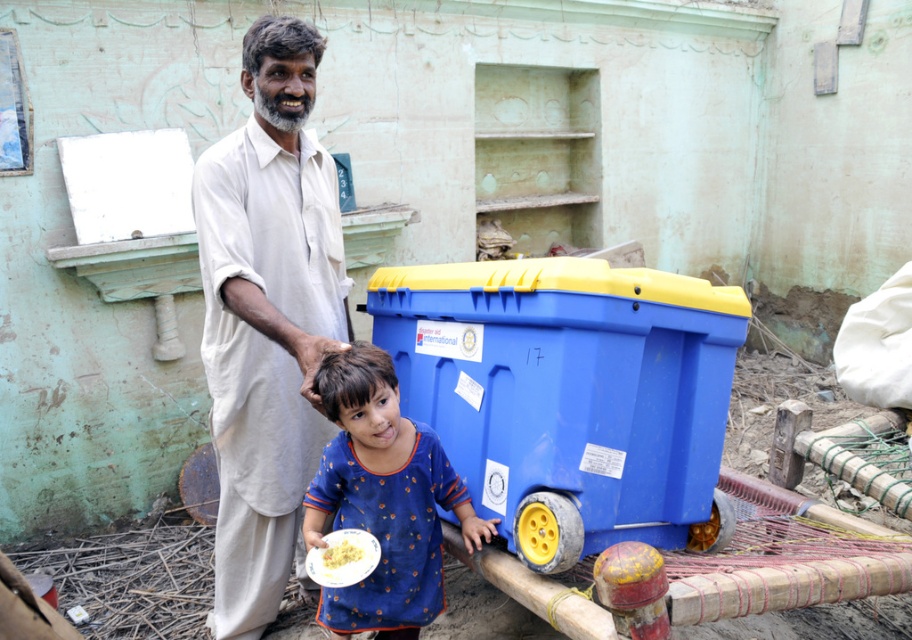
Question: Which point is farther from the camera taking this photo?

Choices:
 (A) (328, 554)
 (B) (275, 305)

Answer: (B)

Question: Is light beige cotton shirt at center bigger than blue printed shirt at center?

Choices:
 (A) yes
 (B) no

Answer: (A)

Question: Which point is closer to the camera?

Choices:
 (A) (295, 468)
 (B) (591, 305)

Answer: (B)

Question: Can you confirm if blue plastic recycling bin at lower right is thinner than light beige cotton shirt at center?

Choices:
 (A) no
 (B) yes

Answer: (A)

Question: Observing the image, what is the correct spatial positioning of blue plastic recycling bin at lower right in reference to blue printed shirt at center?

Choices:
 (A) above
 (B) below

Answer: (A)

Question: Among these points, which one is farthest from the camera?

Choices:
 (A) (484, 522)
 (B) (633, 368)

Answer: (A)